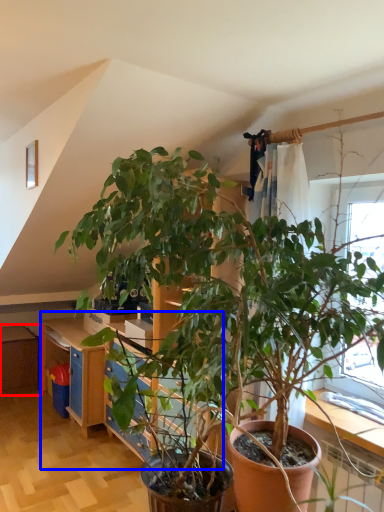
Question: Which of the following is the closest to the observer, dresser (highlighted by a red box) or dresser (highlighted by a blue box)?

Choices:
 (A) dresser
 (B) dresser

Answer: (B)